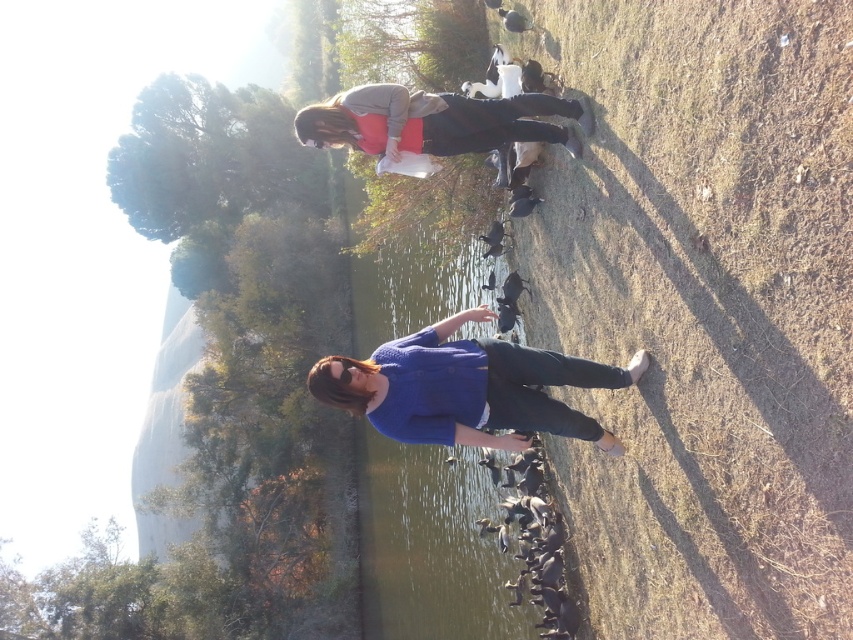
Question: Which point is closer to the camera?

Choices:
 (A) matte gray sweater at upper center
 (B) clear water at center

Answer: (B)

Question: Which of these objects is positioned farthest from the clear water at center?

Choices:
 (A) blue knitted sweater at center
 (B) matte gray sweater at upper center

Answer: (B)

Question: Is clear water at center closer to the viewer compared to matte gray sweater at upper center?

Choices:
 (A) yes
 (B) no

Answer: (A)

Question: Can you confirm if blue knitted sweater at center is positioned to the left of matte gray sweater at upper center?

Choices:
 (A) no
 (B) yes

Answer: (A)

Question: From the image, what is the correct spatial relationship of clear water at center in relation to blue knitted sweater at center?

Choices:
 (A) above
 (B) below

Answer: (B)

Question: Among these objects, which one is farthest from the camera?

Choices:
 (A) matte gray sweater at upper center
 (B) blue knitted sweater at center

Answer: (A)